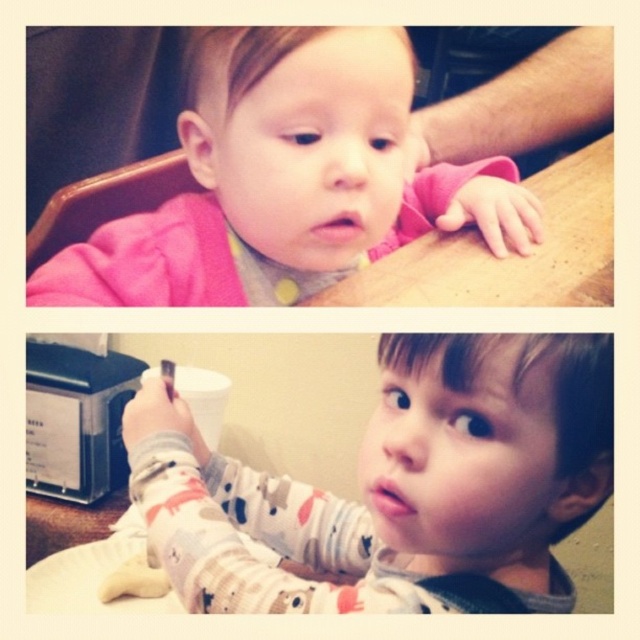
Question: Is the position of printed cotton pajamas at center more distant than that of wooden table at upper center?

Choices:
 (A) no
 (B) yes

Answer: (A)

Question: Which object is positioned closest to the printed cotton pajamas at center?

Choices:
 (A) wooden table at upper center
 (B) pink soft fabric toddler at upper center

Answer: (B)

Question: Does pink soft fabric toddler at upper center lie behind wooden table at upper center?

Choices:
 (A) no
 (B) yes

Answer: (A)

Question: Estimate the real-world distances between objects in this image. Which object is closer to the wooden table at upper center?

Choices:
 (A) pink soft fabric toddler at upper center
 (B) printed cotton pajamas at center

Answer: (A)

Question: Which point appears farthest from the camera in this image?

Choices:
 (A) (145, 451)
 (B) (424, 189)

Answer: (B)

Question: Can you confirm if printed cotton pajamas at center is positioned above wooden table at upper center?

Choices:
 (A) yes
 (B) no

Answer: (B)